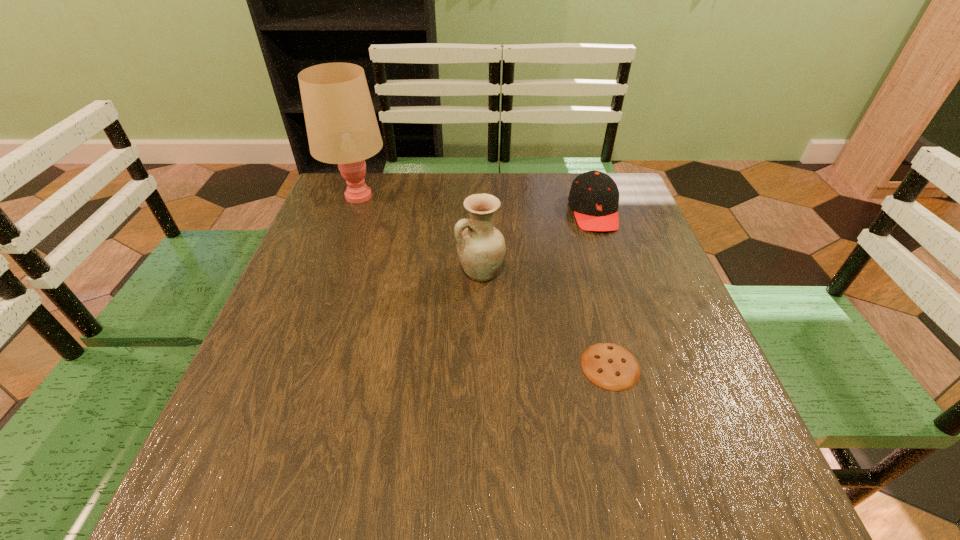
I want to click on lampshade, so click(341, 124).

At what (x,y) coordinates should I click in order to perform the action: click on the leftmost object. Please return your answer as a coordinate pair (x, y). Looking at the image, I should click on (341, 124).

You are a GUI agent. You are given a task and a screenshot of the screen. Output one action in this format:
    pyautogui.click(x=<x>, y=<y>)
    Task: Click on the second object from left to right
    Image resolution: width=960 pixels, height=540 pixels.
    Given the screenshot: What is the action you would take?
    pyautogui.click(x=481, y=247)

Locate an element on the screen. The height and width of the screenshot is (540, 960). the second nearest object is located at coordinates (481, 247).

Locate an element on the screen. This screenshot has height=540, width=960. cap is located at coordinates (594, 196).

The width and height of the screenshot is (960, 540). I want to click on cookie, so click(x=610, y=366).

Image resolution: width=960 pixels, height=540 pixels. Identify the location of the nearest object. (610, 366).

Where is `vacant space situated 0.140m on the right of the lampshade`? The image size is (960, 540). vacant space situated 0.140m on the right of the lampshade is located at coordinates (440, 197).

Image resolution: width=960 pixels, height=540 pixels. Find the location of `blank space located 0.390m on the back of the pottery`. blank space located 0.390m on the back of the pottery is located at coordinates (480, 175).

I want to click on free space located on the front-facing side of the cap, so click(644, 363).